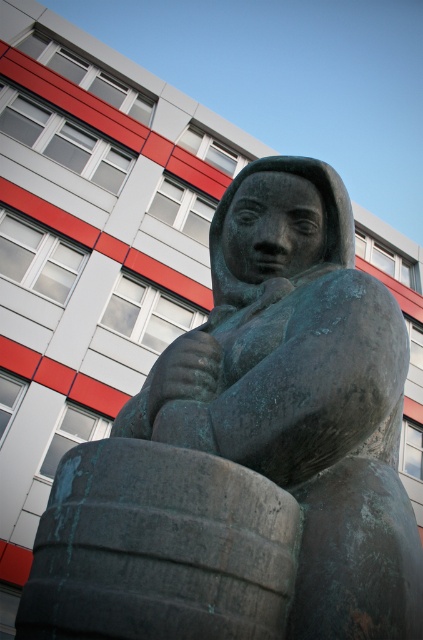
You are standing in front of a statue in a park. You want to take a photo of the green patina stone statue at center. Where should you position yourself to capture it in the frame?

The green patina stone statue at center is located at point (x=249, y=448), so you should position yourself directly in front of that coordinate to capture it in the frame.